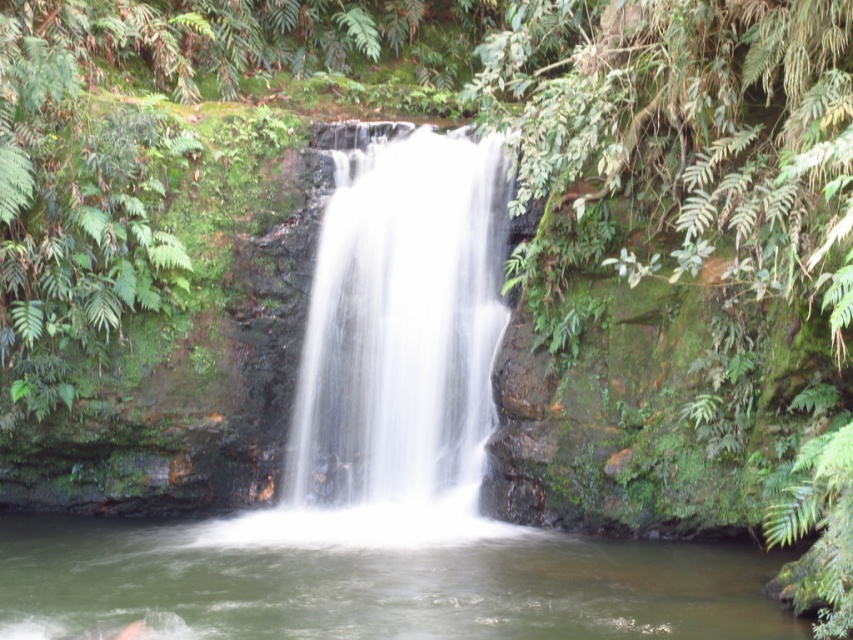
You are standing at the base of the waterfall and want to take a photo. You notice two points in the scene labeled as point 1 at coordinates point 1 at point (704, 625) and point 2 at point (439, 477). Which point is closer to your camera lens when you aim it towards the waterfall?

Point 1 at point (704, 625) is closer to the camera than point 2 at point (439, 477), so it will appear larger in the photo.

You are a photographer planning to capture the waterfall and the pool in the scene. You want to ensure both the greenish water at center and the white smooth waterfall at center are clearly visible in your shot. Given their sizes, which one should you focus on to ensure it takes up more space in your photo?

The greenish water at center has a larger size compared to the white smooth waterfall at center, so focusing on it will ensure it takes up more space in your photo.